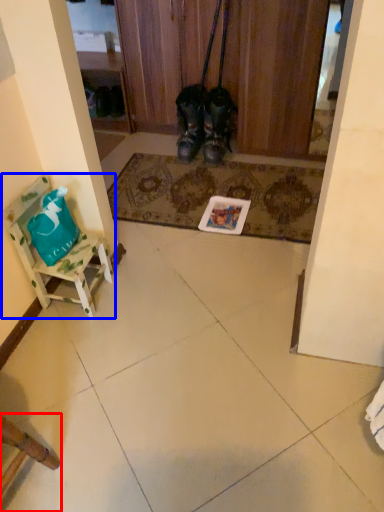
Question: Which object is closer to the camera taking this photo, chair (highlighted by a red box) or furniture (highlighted by a blue box)?

Choices:
 (A) chair
 (B) furniture

Answer: (A)